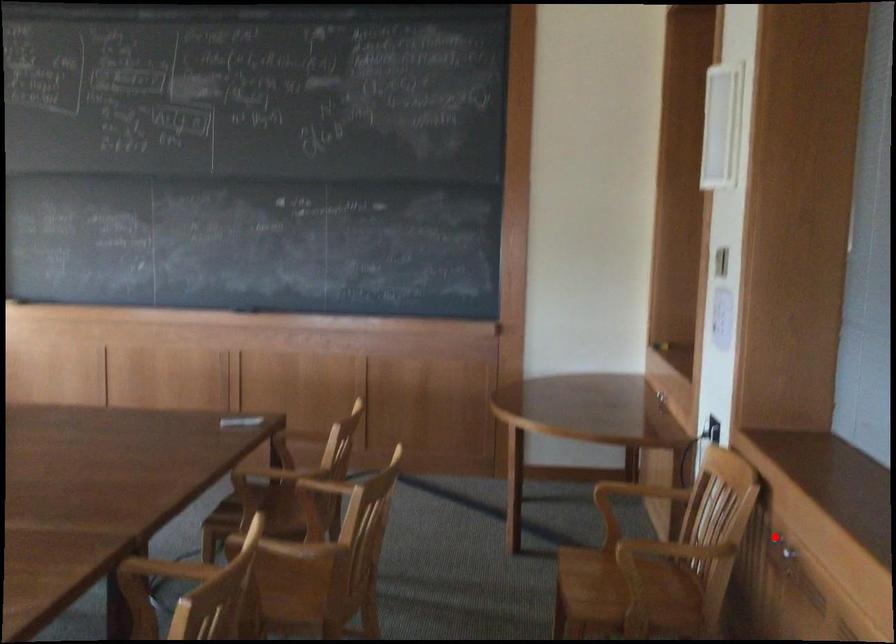
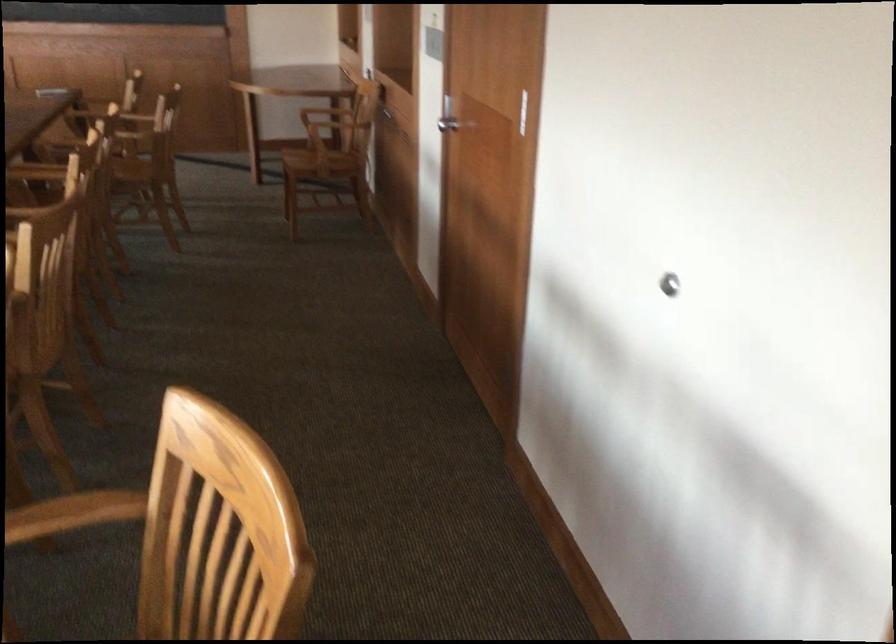
Question: I am providing you with two images of the same scene from different viewpoints. A red point is marked on the first image. At the location where the point appears in image 1, is it still visible in image 2?

Choices:
 (A) Yes
 (B) No

Answer: (B)